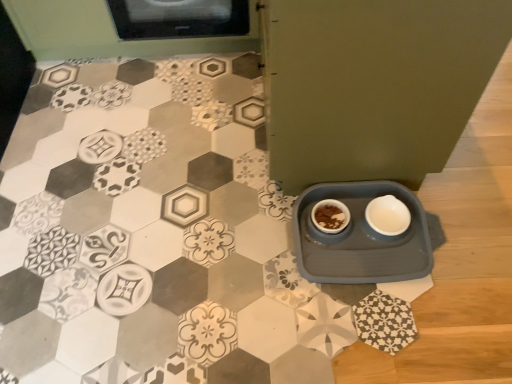
Question: From a real-world perspective, is gray plastic tray at lower right positioned over brown matte bowl at center based on gravity?

Choices:
 (A) no
 (B) yes

Answer: (A)

Question: Can you confirm if gray plastic tray at lower right is bigger than brown matte bowl at center?

Choices:
 (A) yes
 (B) no

Answer: (A)

Question: Does gray plastic tray at lower right appear on the left side of brown matte bowl at center?

Choices:
 (A) yes
 (B) no

Answer: (B)

Question: Can you confirm if gray plastic tray at lower right is positioned to the right of brown matte bowl at center?

Choices:
 (A) yes
 (B) no

Answer: (A)

Question: Is gray plastic tray at lower right looking in the opposite direction of brown matte bowl at center?

Choices:
 (A) no
 (B) yes

Answer: (B)

Question: From the image's perspective, is gray plastic tray at lower right on top of brown matte bowl at center?

Choices:
 (A) no
 (B) yes

Answer: (A)

Question: Is gray plastic tray at lower right oriented towards white matte bowl at lower right?

Choices:
 (A) yes
 (B) no

Answer: (A)

Question: Is gray plastic tray at lower right positioned far away from white matte bowl at lower right?

Choices:
 (A) no
 (B) yes

Answer: (A)

Question: Considering the relative sizes of gray plastic tray at lower right and white matte bowl at lower right in the image provided, is gray plastic tray at lower right bigger than white matte bowl at lower right?

Choices:
 (A) no
 (B) yes

Answer: (B)

Question: Is gray plastic tray at lower right positioned beyond the bounds of white matte bowl at lower right?

Choices:
 (A) yes
 (B) no

Answer: (A)

Question: Is gray plastic tray at lower right taller than white matte bowl at lower right?

Choices:
 (A) yes
 (B) no

Answer: (A)

Question: Is white matte bowl at lower right inside gray plastic tray at lower right?

Choices:
 (A) no
 (B) yes

Answer: (B)

Question: Considering the relative sizes of white matte bowl at lower right and brown matte bowl at center in the image provided, is white matte bowl at lower right bigger than brown matte bowl at center?

Choices:
 (A) no
 (B) yes

Answer: (B)